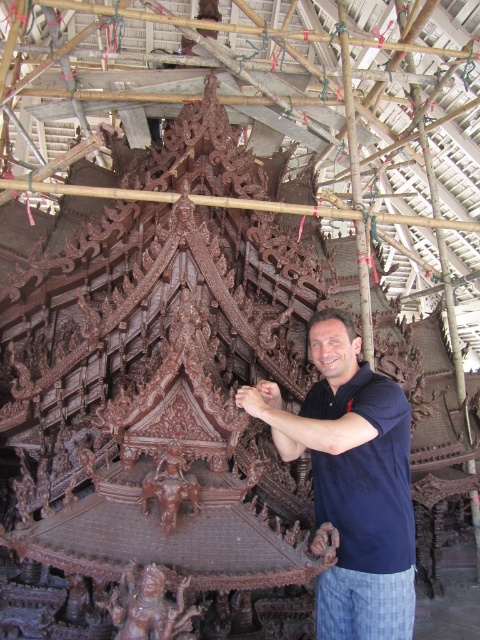
You are an architect visiting the construction site of a temple. You notice the brown carved statue at lower center and the brown carved elephant at center. Which one is shorter?

The brown carved statue at lower center is shorter than the brown carved elephant at center.